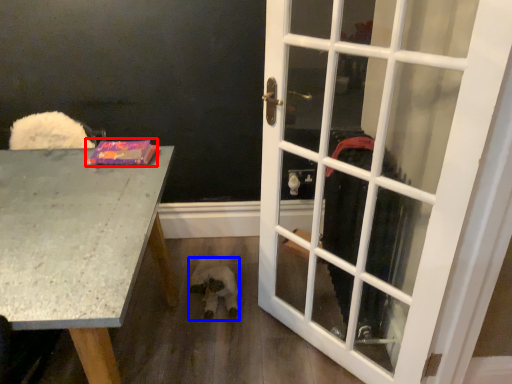
Question: Which object appears farthest to the camera in this image, book (highlighted by a red box) or animal (highlighted by a blue box)?

Choices:
 (A) book
 (B) animal

Answer: (B)